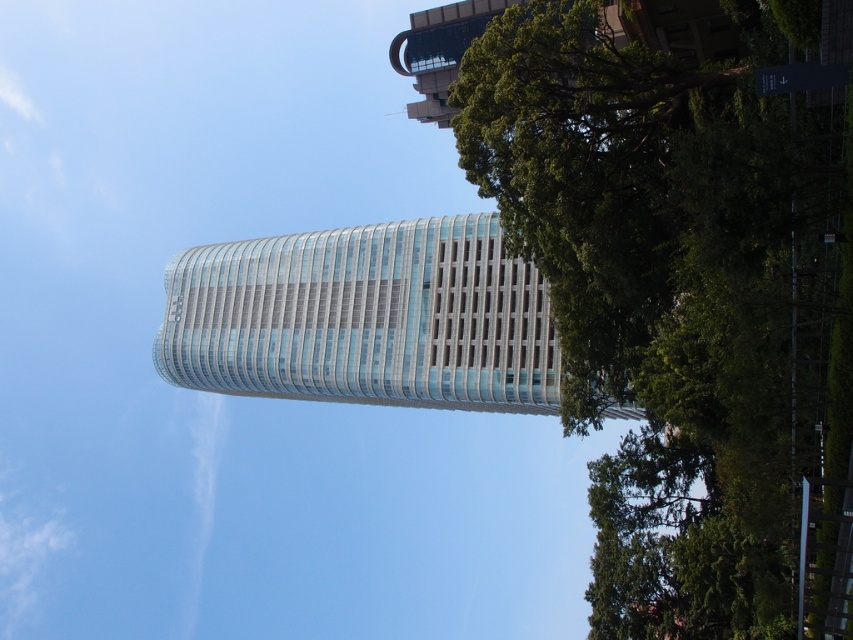
Question: Is green leafy tree at upper right above glassy silver tower at center?

Choices:
 (A) yes
 (B) no

Answer: (B)

Question: Which point is farther to the camera?

Choices:
 (A) (666, 371)
 (B) (405, 252)

Answer: (B)

Question: Is the position of green leafy tree at upper right more distant than that of glassy silver tower at center?

Choices:
 (A) no
 (B) yes

Answer: (A)

Question: Can you confirm if green leafy tree at upper right is positioned to the right of glassy silver tower at center?

Choices:
 (A) yes
 (B) no

Answer: (A)

Question: Which of the following is the closest to the observer?

Choices:
 (A) (225, 385)
 (B) (637, 602)

Answer: (B)